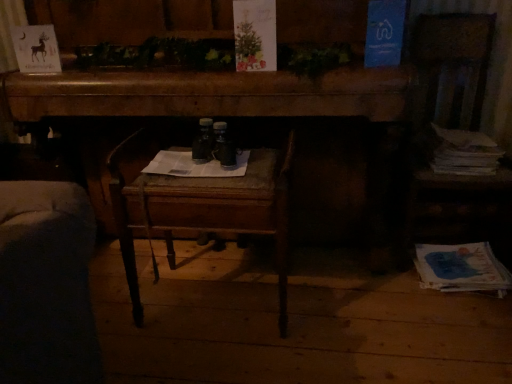
Find the location of a particular element. The image size is (512, 384). free area in between wooden chair at center and wooden desk at center is located at coordinates (259, 309).